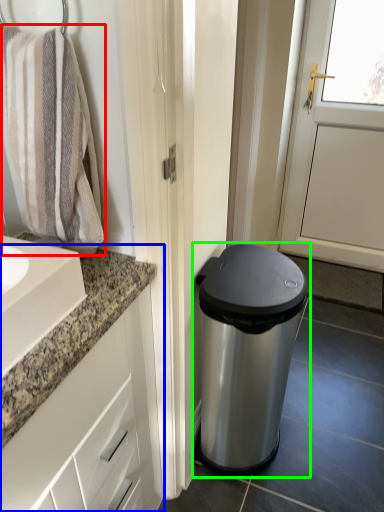
Question: Estimate the real-world distances between objects in this image. Which object is farther from bath towel (highlighted by a red box), bathroom cabinet (highlighted by a blue box) or waste container (highlighted by a green box)?

Choices:
 (A) bathroom cabinet
 (B) waste container

Answer: (B)